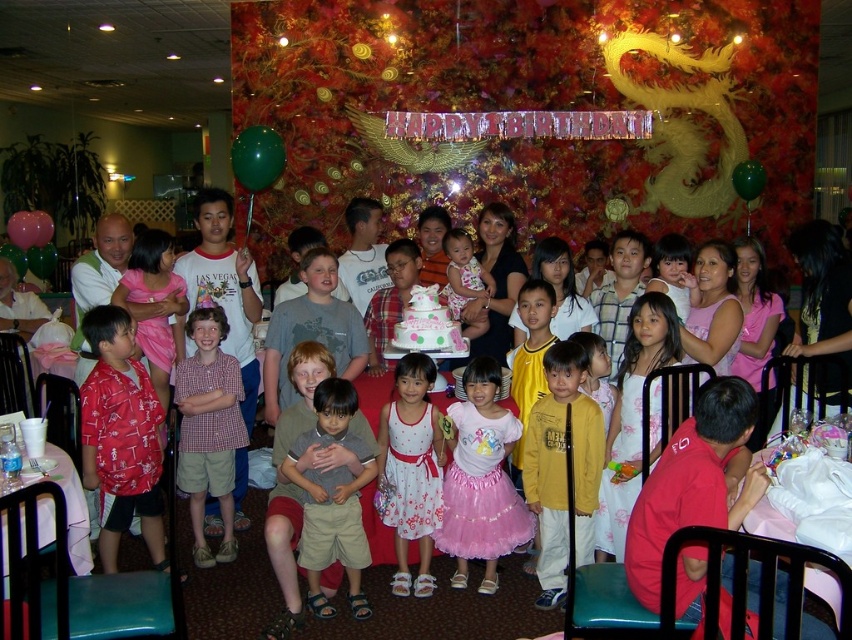
Looking at this image, does yellow matte shirt at center appear over plaid cotton shirt at center?

Incorrect, yellow matte shirt at center is not positioned above plaid cotton shirt at center.

Does point (548, 360) come behind point (216, 449)?

That is False.

Identify the location of yellow matte shirt at center. Image resolution: width=852 pixels, height=640 pixels. (562, 468).

Between plaid cotton shirt at center and white frosted cake at center, which one has less height?

white frosted cake at center

Is plaid cotton shirt at center taller than white frosted cake at center?

Correct, plaid cotton shirt at center is much taller as white frosted cake at center.

Identify the location of plaid cotton shirt at center. (208, 429).

Does pink satin cake at center lie behind yellow matte shirt at center?

Yes, it is behind yellow matte shirt at center.

Can you confirm if pink satin cake at center is bigger than yellow matte shirt at center?

Indeed, pink satin cake at center has a larger size compared to yellow matte shirt at center.

Is point (257, 534) less distant than point (582, 432)?

No, it is not.

Find the location of a particular element. pink satin cake at center is located at coordinates (446, 609).